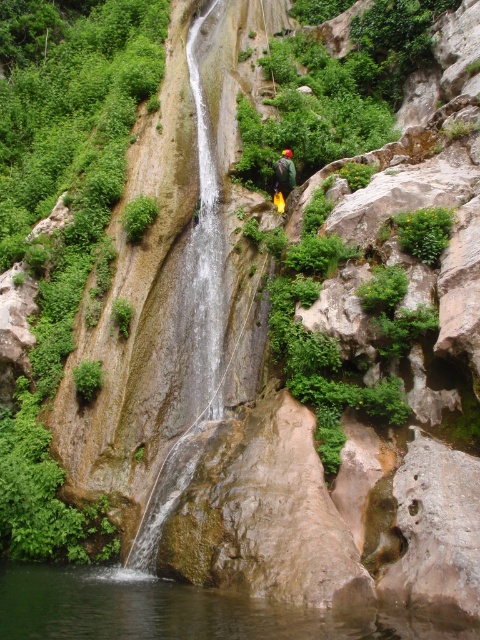
Question: Does clear water at center have a lesser width compared to green fabric helmet at center?

Choices:
 (A) no
 (B) yes

Answer: (A)

Question: Can you confirm if clear water at center is positioned to the left of green fabric helmet at center?

Choices:
 (A) yes
 (B) no

Answer: (A)

Question: Among these objects, which one is nearest to the camera?

Choices:
 (A) clear water at center
 (B) green fabric helmet at center

Answer: (A)

Question: Where is clear water at center located in relation to green fabric helmet at center in the image?

Choices:
 (A) below
 (B) above

Answer: (A)

Question: Which of the following is the farthest from the observer?

Choices:
 (A) clear water at center
 (B) green fabric helmet at center

Answer: (B)